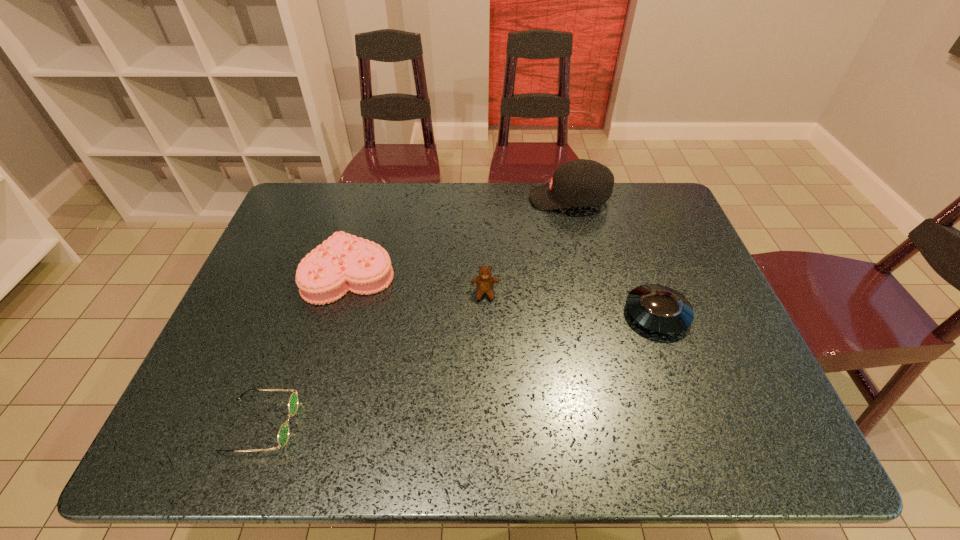
Identify the location of baseball cap. (578, 183).

Where is `the farthest object`? the farthest object is located at coordinates (578, 183).

Where is `teddy bear`? teddy bear is located at coordinates (484, 282).

You are a GUI agent. You are given a task and a screenshot of the screen. Output one action in this format:
    pyautogui.click(x=<x>, y=<y>)
    Task: Click on the second tallest object
    
    Given the screenshot: What is the action you would take?
    pyautogui.click(x=484, y=282)

Locate an element on the screen. The image size is (960, 540). the third shortest object is located at coordinates (343, 262).

Identify the location of the second shortest object. (658, 308).

Locate an element on the screen. Image resolution: width=960 pixels, height=540 pixels. the shortest object is located at coordinates (283, 433).

Locate an element on the screen. The width and height of the screenshot is (960, 540). the nearest object is located at coordinates (283, 433).

Identify the location of vacant space located with a logo on the front of the baseball cap. This screenshot has height=540, width=960. (466, 199).

The image size is (960, 540). What are the coordinates of `blank space located 0.170m with a logo on the front of the baseball cap` in the screenshot? It's located at (478, 199).